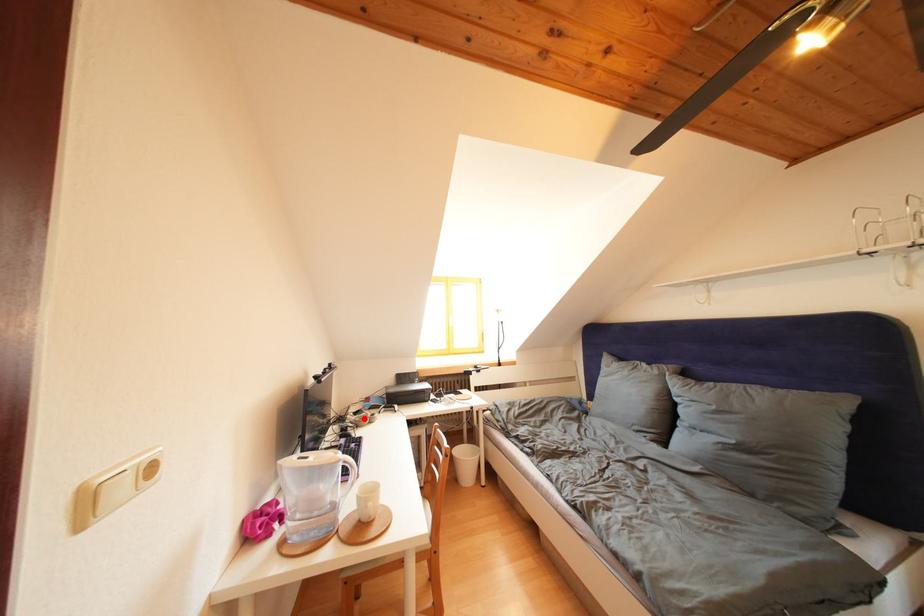
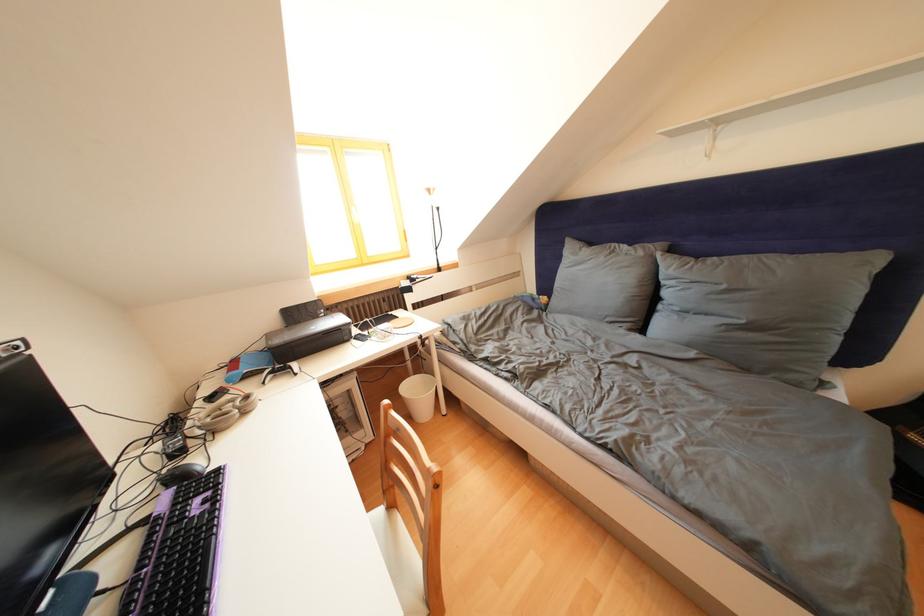
Question: I am providing you with two images of the same scene from different viewpoints. In image1, a red point is highlighted. Considering the same 3D point in image2, which of the following is correct?

Choices:
 (A) It is closer
 (B) It is farther

Answer: (A)